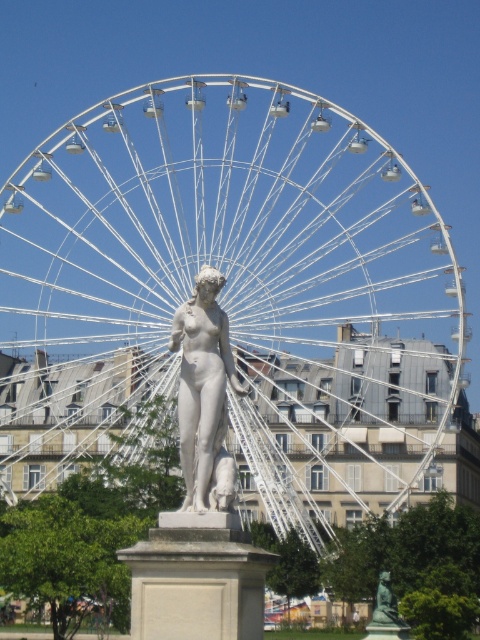
Question: Does white metallic ferris wheel at center have a larger size compared to white marble statue at center?

Choices:
 (A) yes
 (B) no

Answer: (A)

Question: Is white metallic ferris wheel at center above white marble statue at center?

Choices:
 (A) no
 (B) yes

Answer: (B)

Question: Which point appears farthest from the camera in this image?

Choices:
 (A) (194, 339)
 (B) (443, 324)

Answer: (B)

Question: Can you confirm if white metallic ferris wheel at center is positioned to the right of white marble statue at center?

Choices:
 (A) no
 (B) yes

Answer: (B)